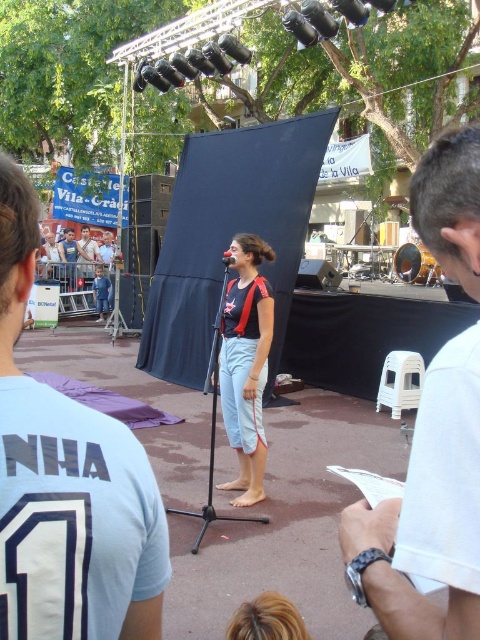
Question: Can you confirm if white cotton shirt at center is wider than matte black tank top at center?

Choices:
 (A) no
 (B) yes

Answer: (A)

Question: Among these objects, which one is farthest from the camera?

Choices:
 (A) matte black tank top at center
 (B) black matte microphone at center

Answer: (A)

Question: Which point is closer to the camera taking this photo?

Choices:
 (A) (458, 275)
 (B) (223, 257)

Answer: (A)

Question: Which point appears farthest from the camera in this image?

Choices:
 (A) (469, 195)
 (B) (247, 390)

Answer: (B)

Question: Does matte black tank top at center have a smaller size compared to black matte microphone at center?

Choices:
 (A) no
 (B) yes

Answer: (A)

Question: Does white cotton shirt at center appear over matte black tank top at center?

Choices:
 (A) yes
 (B) no

Answer: (A)